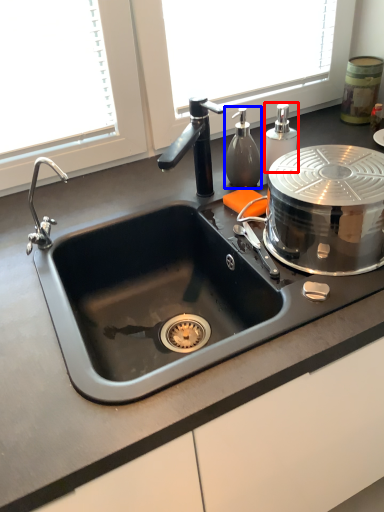
Question: Which object is closer to the camera taking this photo, soap dispenser (highlighted by a red box) or soap dispenser (highlighted by a blue box)?

Choices:
 (A) soap dispenser
 (B) soap dispenser

Answer: (B)